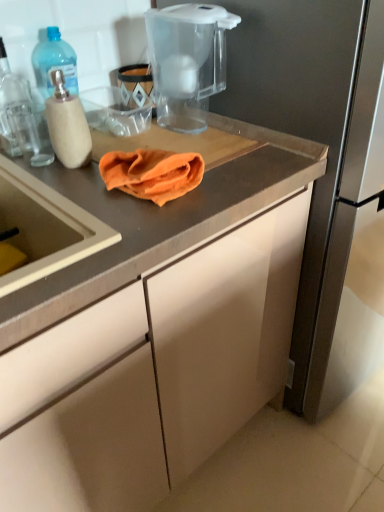
Question: In which direction should I rotate to look at transparent plastic water filter pitcher at upper center?

Choices:
 (A) right
 (B) left

Answer: (B)

Question: Is orange cloth at center located outside transparent plastic water filter pitcher at upper center?

Choices:
 (A) no
 (B) yes

Answer: (B)

Question: Is orange cloth at center taller than transparent plastic water filter pitcher at upper center?

Choices:
 (A) no
 (B) yes

Answer: (A)

Question: From a real-world perspective, is orange cloth at center located beneath transparent plastic water filter pitcher at upper center?

Choices:
 (A) no
 (B) yes

Answer: (B)

Question: From the image's perspective, would you say orange cloth at center is shown under transparent plastic water filter pitcher at upper center?

Choices:
 (A) yes
 (B) no

Answer: (A)

Question: Is orange cloth at center bigger than transparent plastic water filter pitcher at upper center?

Choices:
 (A) yes
 (B) no

Answer: (B)

Question: Is orange cloth at center far from transparent plastic water filter pitcher at upper center?

Choices:
 (A) yes
 (B) no

Answer: (B)

Question: From the image's perspective, is matte gray cabinet at center located above transparent plastic water filter pitcher at upper center?

Choices:
 (A) yes
 (B) no

Answer: (B)

Question: Is matte gray cabinet at center at the left side of transparent plastic water filter pitcher at upper center?

Choices:
 (A) yes
 (B) no

Answer: (A)

Question: From the image's perspective, would you say matte gray cabinet at center is shown under transparent plastic water filter pitcher at upper center?

Choices:
 (A) yes
 (B) no

Answer: (A)

Question: Is matte gray cabinet at center wider than transparent plastic water filter pitcher at upper center?

Choices:
 (A) yes
 (B) no

Answer: (A)

Question: Is matte gray cabinet at center to the right of transparent plastic water filter pitcher at upper center from the viewer's perspective?

Choices:
 (A) yes
 (B) no

Answer: (B)

Question: Is matte gray cabinet at center aimed at transparent plastic water filter pitcher at upper center?

Choices:
 (A) no
 (B) yes

Answer: (A)

Question: Is translucent plastic bottle at left positioned in front of transparent plastic water filter pitcher at upper center?

Choices:
 (A) yes
 (B) no

Answer: (B)